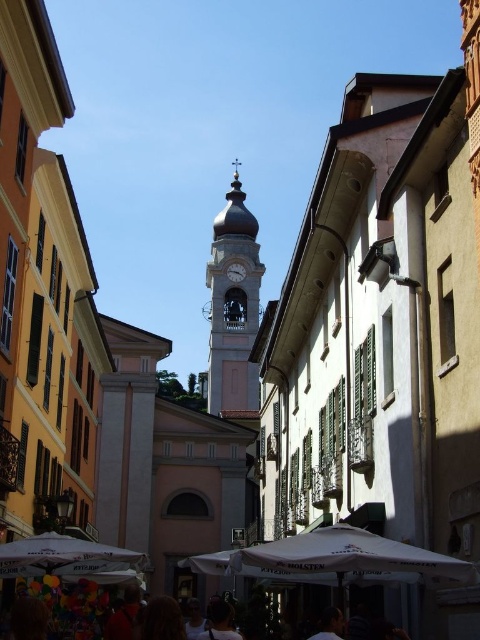
Does white fabric umbrella at lower left appear over dark brown hair at center?

Yes.

Who is taller, white fabric umbrella at lower left or dark brown hair at center?

With more height is dark brown hair at center.

The height and width of the screenshot is (640, 480). I want to click on white fabric umbrella at lower left, so click(x=62, y=556).

Where is `white fabric umbrella at lower left`? white fabric umbrella at lower left is located at coordinates (62, 556).

Is point (241, 410) farther from camera compared to point (322, 637)?

Yes, point (241, 410) is behind point (322, 637).

Is point (229, 317) in front of point (324, 616)?

That is False.

I want to click on white marble bell tower at center, so 232,307.

Between white marble bell tower at center and red shirt at lower center, which one is positioned lower?

red shirt at lower center is below.

Which is behind, point (248, 289) or point (108, 628)?

The point (248, 289) is more distant.

Where is `white marble bell tower at center`? This screenshot has height=640, width=480. white marble bell tower at center is located at coordinates (232, 307).

Identify the location of white marble bell tower at center. This screenshot has height=640, width=480. (232, 307).